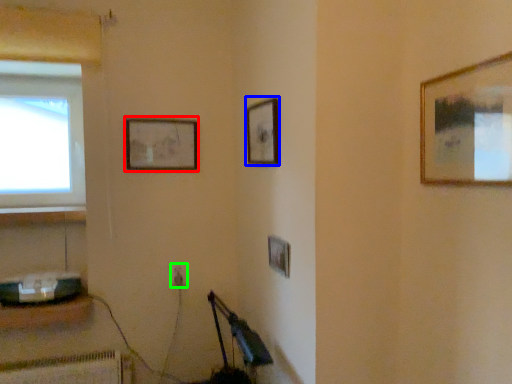
Question: Considering the real-world distances, which object is farthest from picture frame (highlighted by a red box)? picture frame (highlighted by a blue box) or electric outlet (highlighted by a green box)?

Choices:
 (A) picture frame
 (B) electric outlet

Answer: (B)